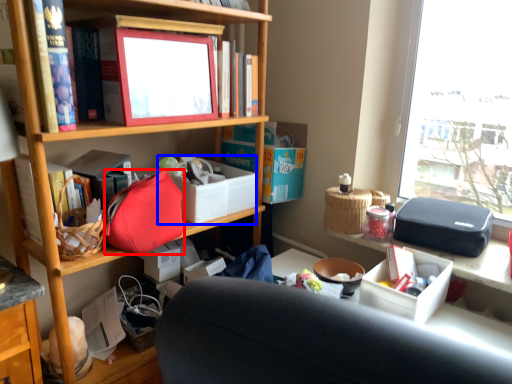
Question: Which of the following is the closest to the observer, handbag (highlighted by a red box) or storage box (highlighted by a blue box)?

Choices:
 (A) handbag
 (B) storage box

Answer: (A)